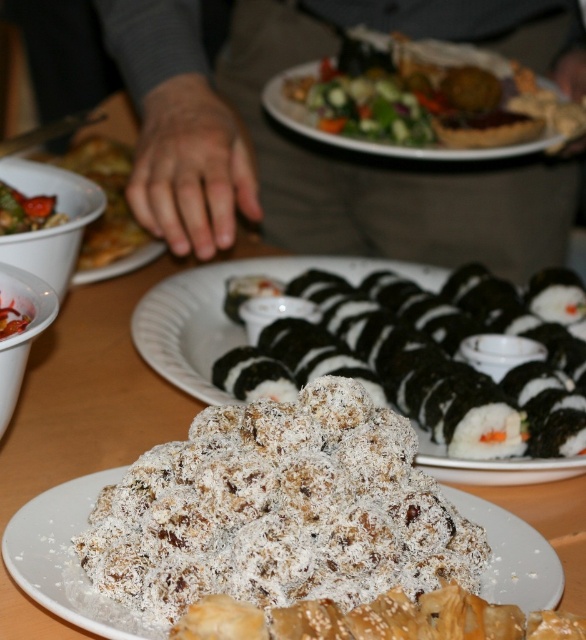
Question: In this image, where is black seaweed sushi at center located relative to green leafy salad at upper center?

Choices:
 (A) right
 (B) left

Answer: (B)

Question: Is white powdered pastry at center closer to camera compared to tomato sauce at upper left?

Choices:
 (A) yes
 (B) no

Answer: (A)

Question: Which object is the closest to the black seaweed sushi at center?

Choices:
 (A) green leafy salad at upper center
 (B) tomato sauce at upper left
 (C) matte white bowl at upper left
 (D) white powdered pastry at center

Answer: (D)

Question: From the image, what is the correct spatial relationship of green leafy salad at upper center in relation to tomato sauce at upper left?

Choices:
 (A) above
 (B) below

Answer: (A)

Question: Estimate the real-world distances between objects in this image. Which object is closer to the white powdered pastry at center?

Choices:
 (A) tomato sauce at upper left
 (B) skinny gray sweater at upper left
 (C) matte white bowl at upper left
 (D) black seaweed sushi at center

Answer: (D)

Question: Which of the following is the closest to the observer?

Choices:
 (A) (18, 209)
 (B) (179, 102)
 (C) (239, 392)
 (D) (113, 257)

Answer: (C)